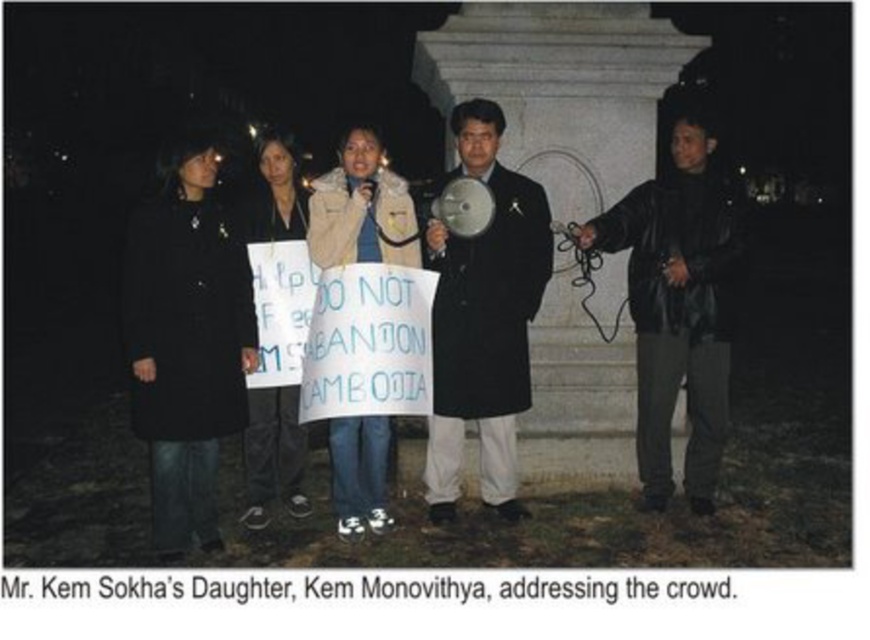
Between leather jacket at right and black matte coat at center, which one is positioned lower?

black matte coat at center is below.

Which is behind, point (638, 410) or point (486, 412)?

Point (638, 410)

What do you see at coordinates (678, 305) in the screenshot? Image resolution: width=870 pixels, height=640 pixels. I see `leather jacket at right` at bounding box center [678, 305].

Where is `leather jacket at right`? This screenshot has width=870, height=640. leather jacket at right is located at coordinates (678, 305).

This screenshot has height=640, width=870. I want to click on leather jacket at right, so click(x=678, y=305).

Which is more to the left, leather jacket at right or black fabric jacket at center?

black fabric jacket at center is more to the left.

Between point (681, 150) and point (249, 456), which one is positioned behind?

Point (249, 456)

This screenshot has height=640, width=870. Find the location of `leather jacket at right`. leather jacket at right is located at coordinates (678, 305).

Can you confirm if beige fleece jacket at center is positioned above black fabric jacket at center?

Yes, beige fleece jacket at center is above black fabric jacket at center.

Is point (320, 266) positioned in front of point (300, 509)?

Yes, point (320, 266) is in front of point (300, 509).

Is point (312, 257) closer to viewer compared to point (293, 472)?

Yes, it is in front of point (293, 472).

At what (x,y) coordinates should I click in order to perform the action: click on beige fleece jacket at center. Please return your answer as a coordinate pair (x, y). The width and height of the screenshot is (870, 640). Looking at the image, I should click on (360, 209).